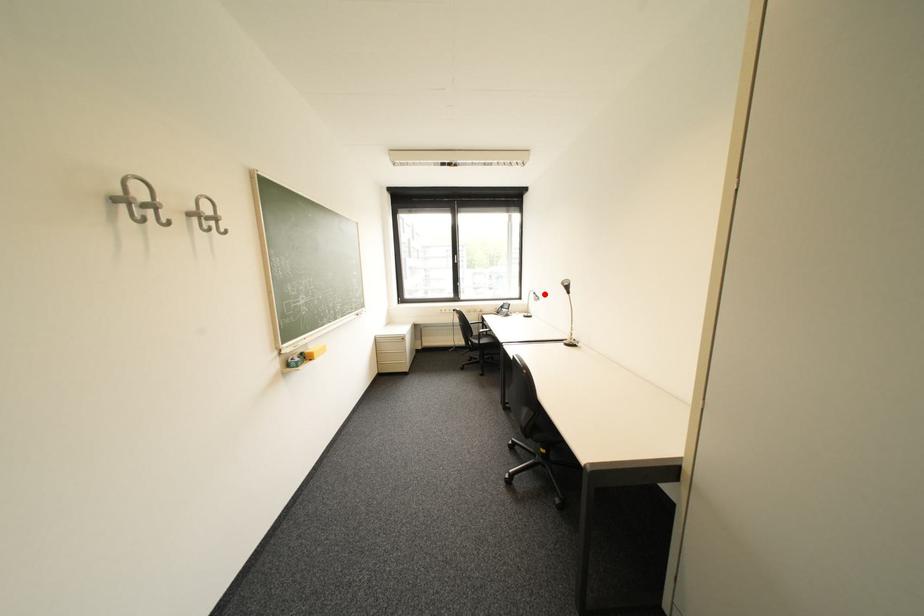
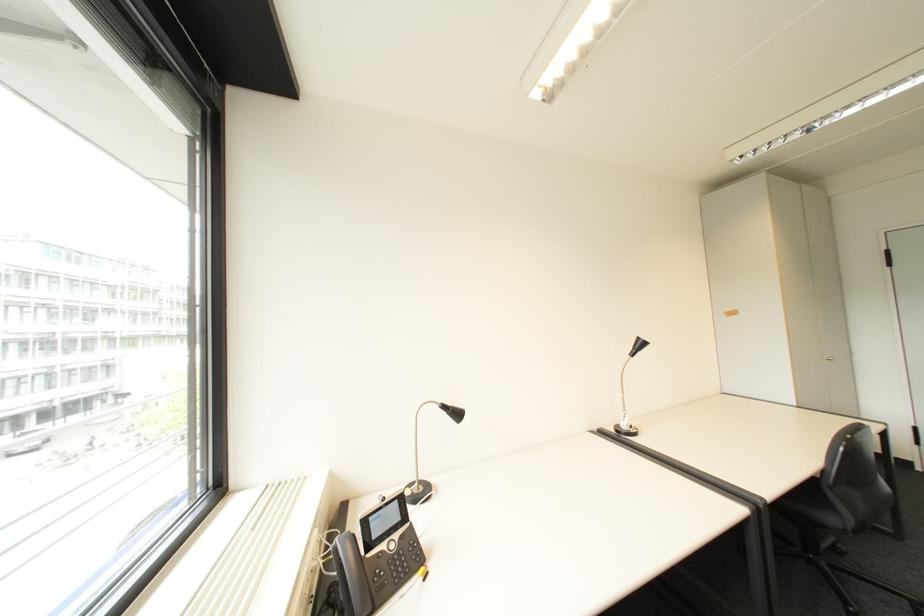
The point at the highlighted location is marked in the first image. Where is the corresponding point in the second image?

(455, 407)